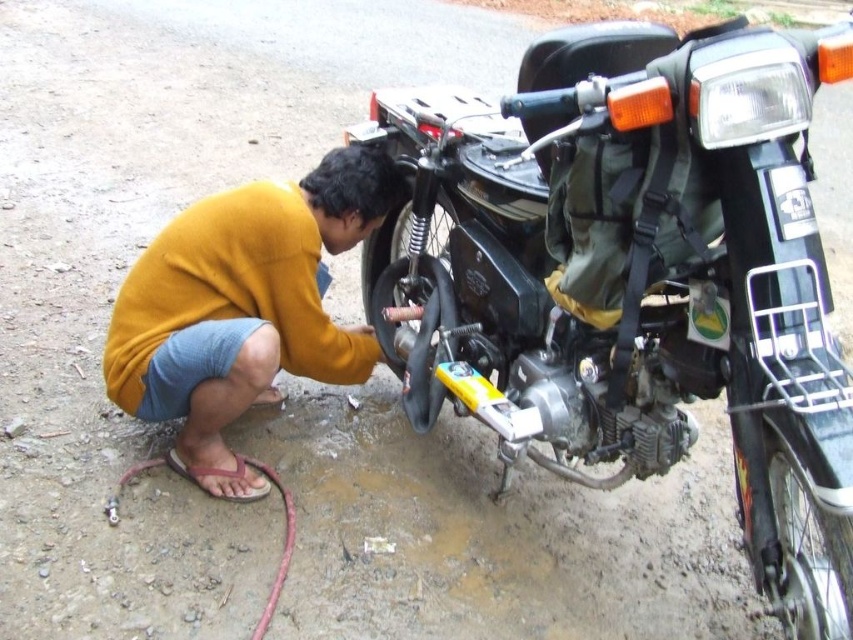
Does black matte motorcycle at center have a lesser height compared to black rubber tire at center?

Incorrect, black matte motorcycle at center's height does not fall short of black rubber tire at center's.

Does point (614, 438) come closer to viewer compared to point (440, 225)?

Yes.

The height and width of the screenshot is (640, 853). In order to click on black matte motorcycle at center in this screenshot , I will do [x=635, y=278].

Does yellow matte shirt at lower left appear on the left side of black rubber tire at center?

Correct, you'll find yellow matte shirt at lower left to the left of black rubber tire at center.

Does point (198, 380) come farther from viewer compared to point (392, 241)?

No, it is in front of (392, 241).

You are a GUI agent. You are given a task and a screenshot of the screen. Output one action in this format:
    pyautogui.click(x=<x>, y=<y>)
    Task: Click on the yellow matte shirt at lower left
    The image size is (853, 640).
    Given the screenshot: What is the action you would take?
    pos(242,308)

Does black matte motorcycle at center appear on the right side of yellow matte shirt at lower left?

Correct, you'll find black matte motorcycle at center to the right of yellow matte shirt at lower left.

The image size is (853, 640). Find the location of `black matte motorcycle at center`. black matte motorcycle at center is located at coordinates (635, 278).

At what (x,y) coordinates should I click in order to perform the action: click on black matte motorcycle at center. Please return your answer as a coordinate pair (x, y). Image resolution: width=853 pixels, height=640 pixels. Looking at the image, I should click on (635, 278).